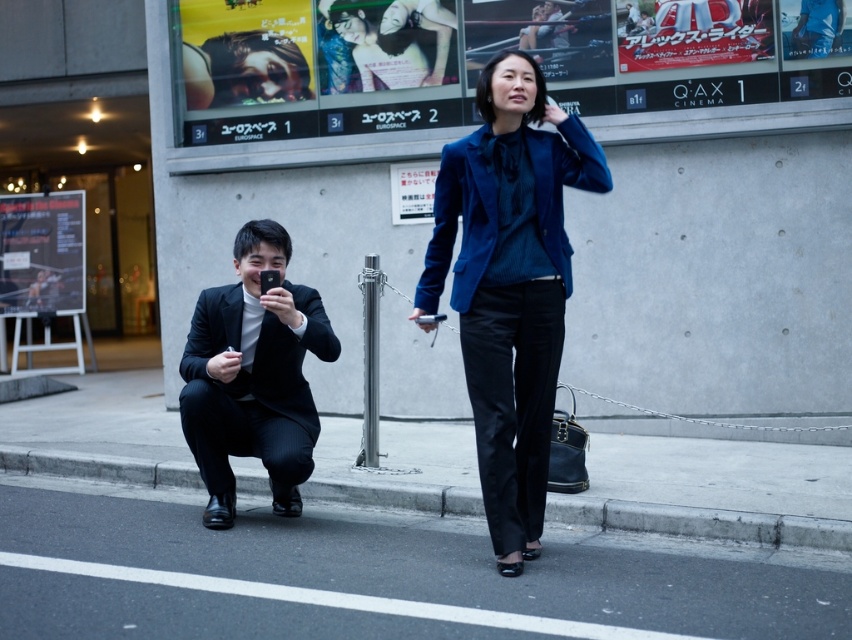
Question: Which point appears closest to the camera in this image?

Choices:
 (A) (527, 170)
 (B) (263, 538)
 (C) (331, 486)

Answer: (A)

Question: Is black suit at left smaller than matte blue blazer at center?

Choices:
 (A) yes
 (B) no

Answer: (B)

Question: Which of the following is the closest to the observer?

Choices:
 (A) (203, 417)
 (B) (383, 8)
 (C) (649, 580)

Answer: (C)

Question: Is velvet blue blazer at center smaller than matte blue blazer at center?

Choices:
 (A) no
 (B) yes

Answer: (A)

Question: Is black suit at left to the right of matte blue blazer at center from the viewer's perspective?

Choices:
 (A) yes
 (B) no

Answer: (B)

Question: Which point appears closest to the camera in this image?

Choices:
 (A) (35, 618)
 (B) (447, 493)

Answer: (A)